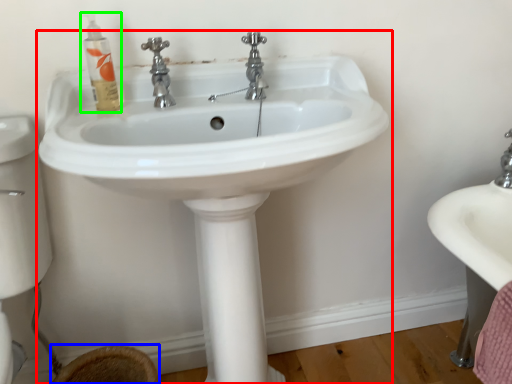
Question: Considering the real-world distances, which object is closest to sink (highlighted by a red box)? toilet bowl (highlighted by a blue box) or mouthwash (highlighted by a green box).

Choices:
 (A) toilet bowl
 (B) mouthwash

Answer: (B)